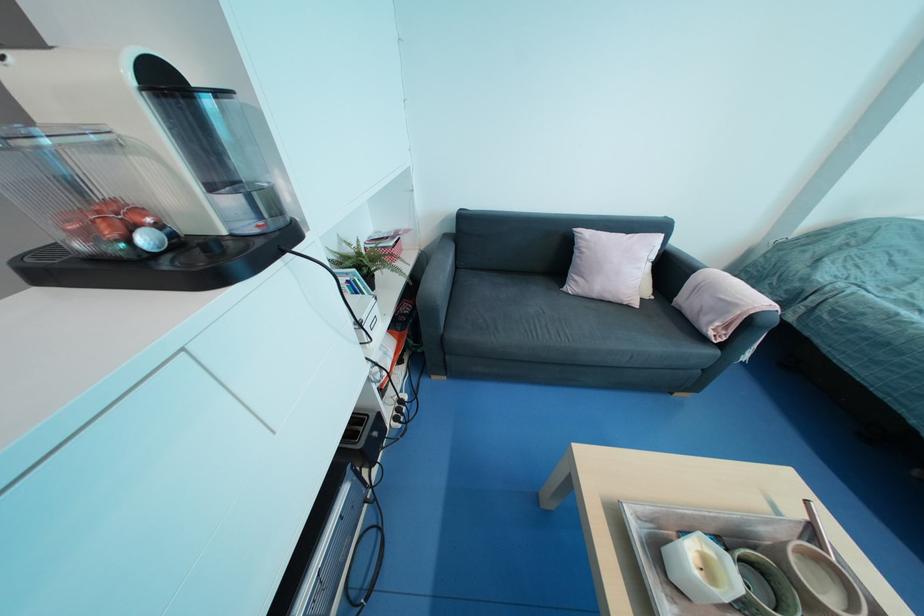
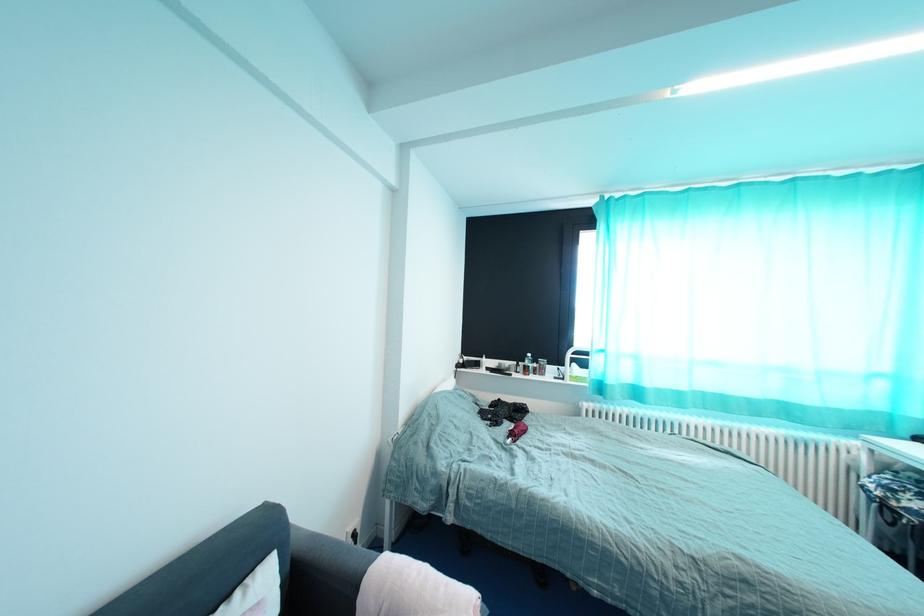
Question: The images are taken continuously from a first-person perspective. In which direction is your viewpoint rotating?

Choices:
 (A) Left
 (B) Right
 (C) Up
 (D) Down

Answer: (B)